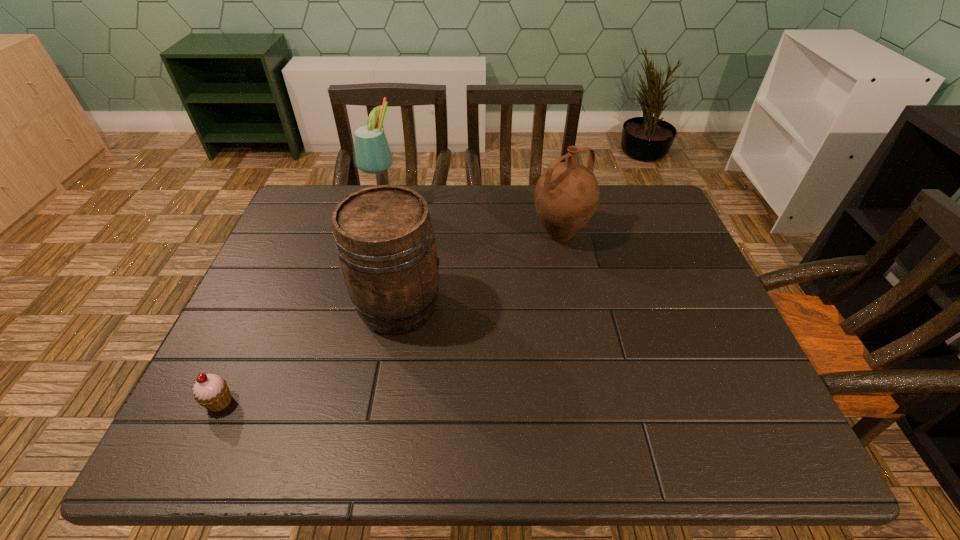
This screenshot has height=540, width=960. Identify the location of pitcher present at the far edge. (566, 195).

Identify the location of object that is at the near edge. (211, 391).

Identify the location of object positioned at the left edge. (211, 391).

I want to click on object located in the near left corner section of the desktop, so click(x=211, y=391).

The width and height of the screenshot is (960, 540). In order to click on vacant space at the far edge of the desktop in this screenshot , I will do `click(527, 227)`.

You are a GUI agent. You are given a task and a screenshot of the screen. Output one action in this format:
    pyautogui.click(x=<x>, y=<y>)
    Task: Click on the free spot at the near edge of the desktop
    Image resolution: width=960 pixels, height=540 pixels.
    Given the screenshot: What is the action you would take?
    pyautogui.click(x=363, y=441)

At what (x,y) coordinates should I click in order to perform the action: click on vacant area at the left edge. Please return your answer as a coordinate pair (x, y). This screenshot has height=540, width=960. Looking at the image, I should click on (313, 241).

In the image, there is a desktop. Where is `free space at the right edge`? This screenshot has height=540, width=960. free space at the right edge is located at coordinates 639,238.

In the image, there is a desktop. Where is `vacant space at the near left corner`? The height and width of the screenshot is (540, 960). vacant space at the near left corner is located at coordinates (252, 417).

Identify the location of vacant space at the far right corner of the desktop. Image resolution: width=960 pixels, height=540 pixels. pyautogui.click(x=670, y=219).